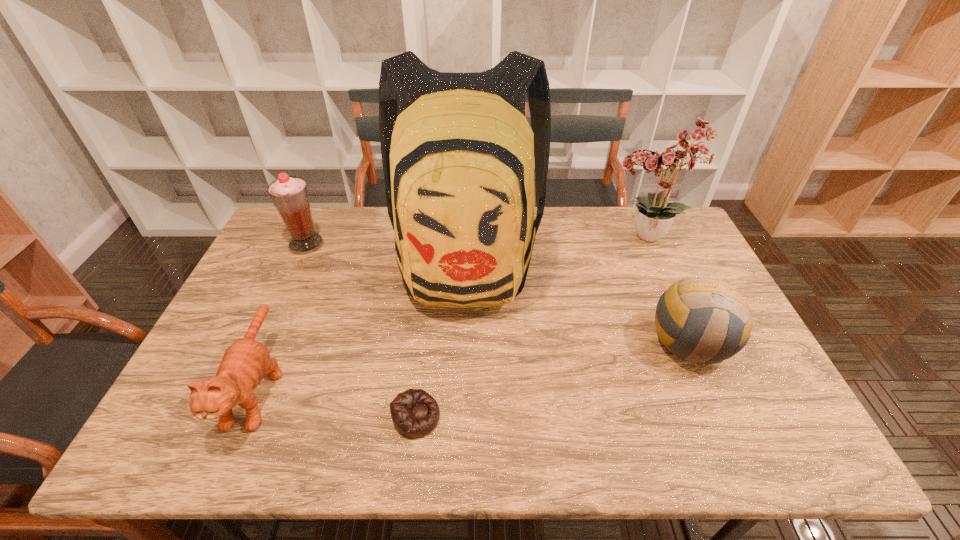
Locate an element on the screen. Image resolution: width=960 pixels, height=540 pixels. the tallest object is located at coordinates (458, 153).

Locate an element on the screen. This screenshot has height=540, width=960. the second tallest object is located at coordinates (654, 215).

Locate an element on the screen. the third tallest object is located at coordinates (289, 194).

This screenshot has width=960, height=540. I want to click on volleyball, so click(702, 320).

This screenshot has width=960, height=540. I want to click on cat, so click(245, 361).

In order to click on beanbag in this screenshot , I will do `click(415, 413)`.

Locate an element on the screen. vacant space positioned 0.210m on the front-facing side of the tallest object is located at coordinates (461, 397).

The height and width of the screenshot is (540, 960). Find the location of `vacant space positioned 0.160m on the front-facing side of the fifth shortest object`. vacant space positioned 0.160m on the front-facing side of the fifth shortest object is located at coordinates (555, 238).

In order to click on vacant space located 0.160m on the front-facing side of the fifth shortest object in this screenshot , I will do `click(555, 238)`.

The image size is (960, 540). In order to click on vacant area situated 0.250m on the front-facing side of the fifth shortest object in this screenshot , I will do `click(529, 238)`.